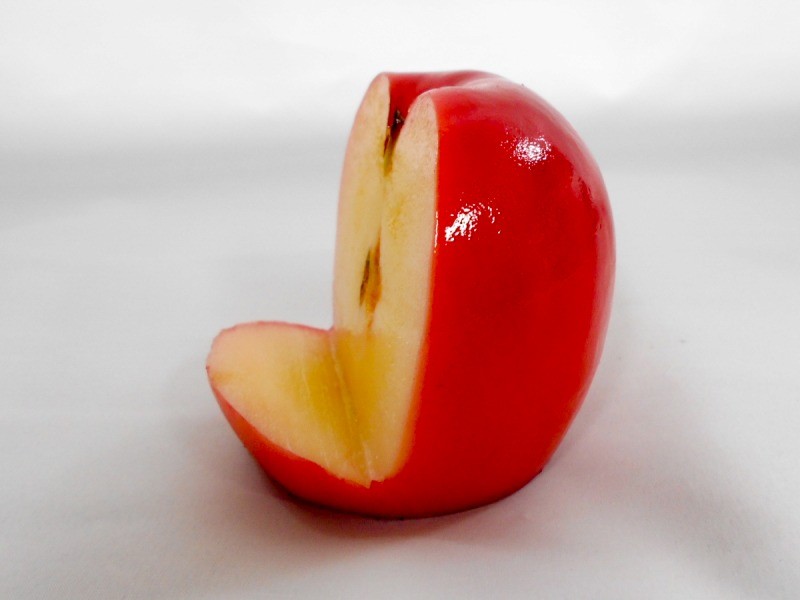
The width and height of the screenshot is (800, 600). I want to click on light, so click(522, 161), click(465, 220), click(557, 36).